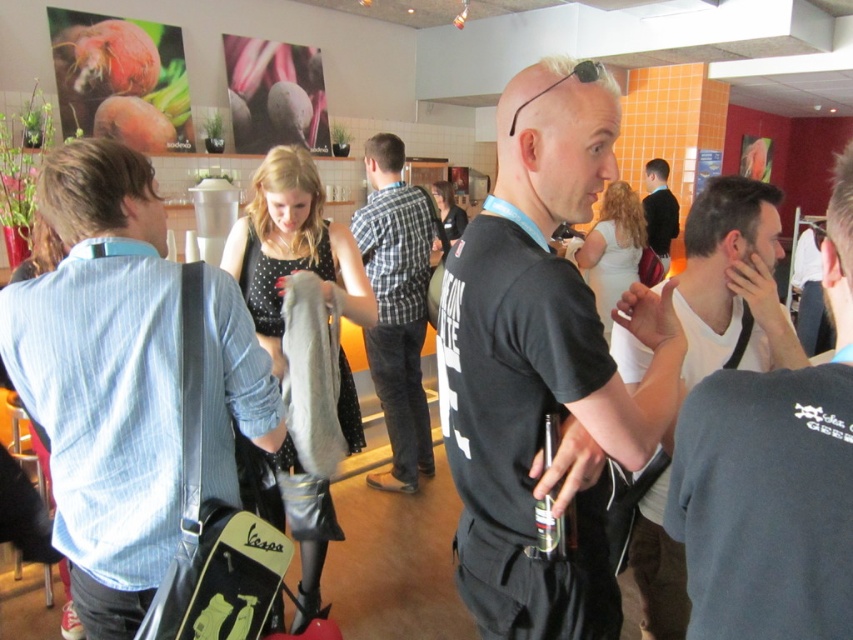
Question: Does black matte t-shirt at center appear on the left side of blue striped shirt at left?

Choices:
 (A) yes
 (B) no

Answer: (B)

Question: Is black matte t-shirt at center smaller than white matte tank top at right?

Choices:
 (A) no
 (B) yes

Answer: (B)

Question: Does black matte t-shirt at center appear under plaid fabric shirt at center?

Choices:
 (A) no
 (B) yes

Answer: (B)

Question: Which object is farther from the camera taking this photo?

Choices:
 (A) black matte t-shirt at center
 (B) blue striped shirt at left

Answer: (B)

Question: Estimate the real-world distances between objects in this image. Which object is farther from the dark blue shirt at center?

Choices:
 (A) blue striped shirt at left
 (B) white matte tank top at right
 (C) plaid fabric shirt at center

Answer: (A)

Question: Which of the following is the farthest from the observer?

Choices:
 (A) (585, 81)
 (B) (712, 333)

Answer: (B)